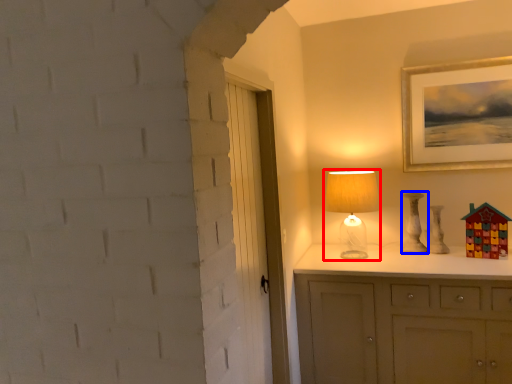
Question: Which object appears farthest to the camera in this image, table lamp (highlighted by a red box) or lamp (highlighted by a blue box)?

Choices:
 (A) table lamp
 (B) lamp

Answer: (B)